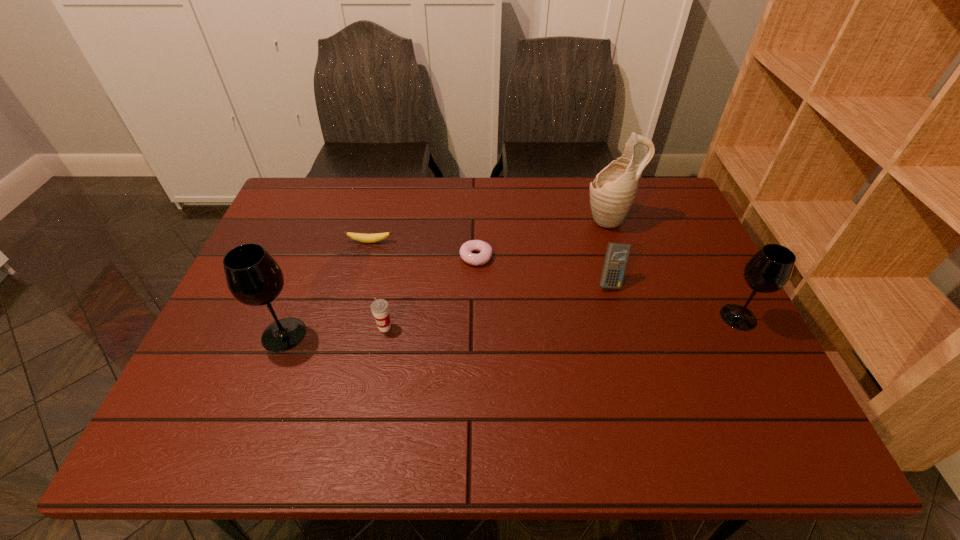
This screenshot has height=540, width=960. I want to click on blank space that satisfies the following two spatial constraints: 1. at the spout of the farthest object; 2. on the side of the cup with the logo, so click(x=643, y=327).

Locate an element on the screen. vacant space that satisfies the following two spatial constraints: 1. on the front side of the fourth object from right to left; 2. on the left side of the banana is located at coordinates (366, 257).

Identify the location of vacant space that satisfies the following two spatial constraints: 1. on the back side of the fourth object from left to right; 2. on the right side of the leftmost object. (313, 257).

I want to click on free point that satisfies the following two spatial constraints: 1. on the back side of the doughnut; 2. on the right side of the taller wineglass, so 313,257.